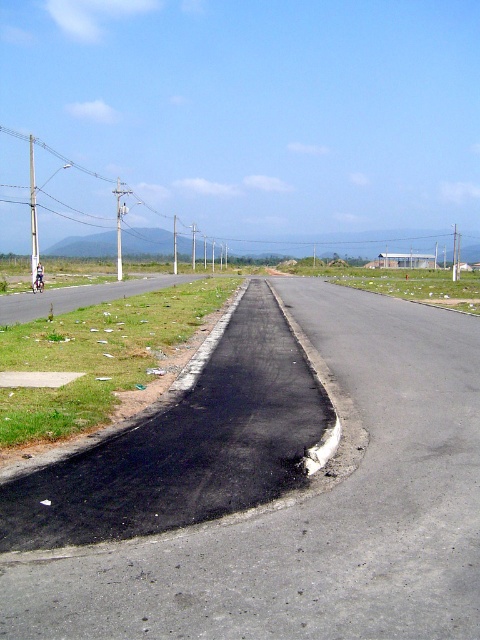
Which is in front, point (36, 280) or point (36, 289)?

Point (36, 289)

Does blue fabric motorcyclist at center appear over metallic silver motorcycle at center?

Yes, blue fabric motorcyclist at center is above metallic silver motorcycle at center.

Find the location of a particular element. blue fabric motorcyclist at center is located at coordinates (38, 276).